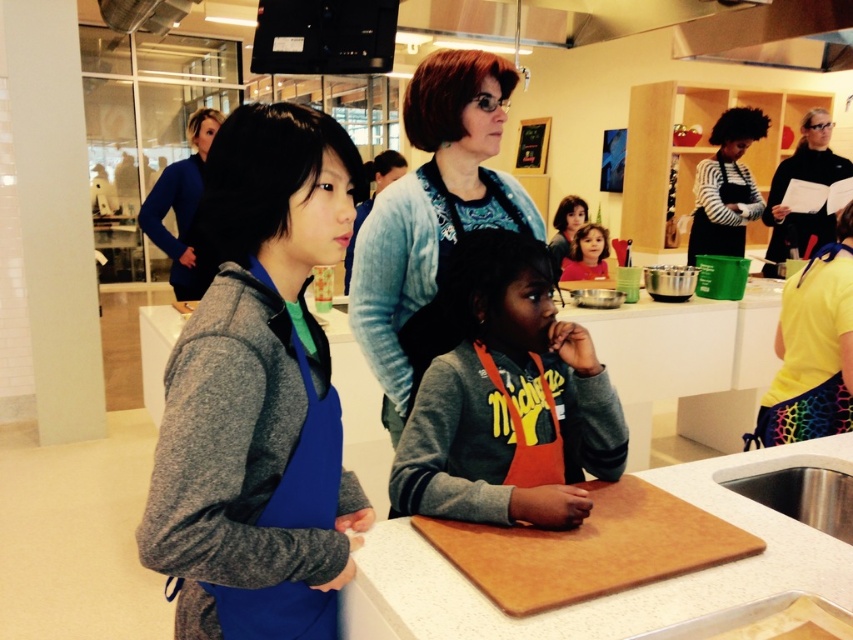
You are a photographer setting up for a group photo in the kitchen. You need to ensure everyone is visible. The matte gray hoodie at center and the blue sweater at upper left are in your frame. Which clothing item is shorter in height?

The matte gray hoodie at center is shorter in height than the blue sweater at upper left.

You are a photographer standing at the entrance of the kitchen. You want to take a photo of the blue denim jacket at center and the black striped shirt at center such that both are in focus. The camera you are using has a depth of field that can cover up to 10 feet. Will both subjects be in focus?

The blue denim jacket at center and black striped shirt at center are 10.35 feet apart from each other. Since the camera can only cover up to 10 feet, the distance between them exceeds the depth of field capacity. Therefore, both subjects cannot be in focus simultaneously.

You are a photographer taking a picture of the blue denim jacket at center and the black striped shirt at center. Which one will be in the foreground of the photo?

The blue denim jacket at center is positioned under the black striped shirt at center, so the blue denim jacket at center will be in the foreground of the photo because it is closer to the camera.